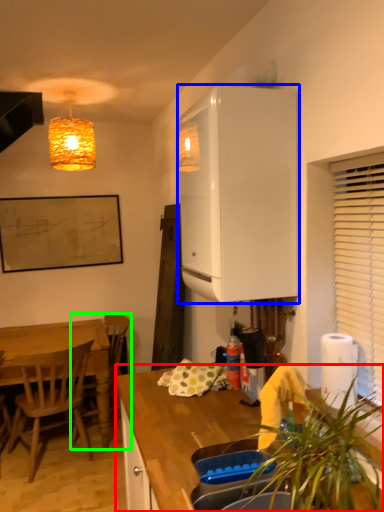
Question: Which object is positioned farthest from countertop (highlighted by a red box)? Select from cabinetry (highlighted by a blue box) and chair (highlighted by a green box).

Choices:
 (A) cabinetry
 (B) chair

Answer: (B)